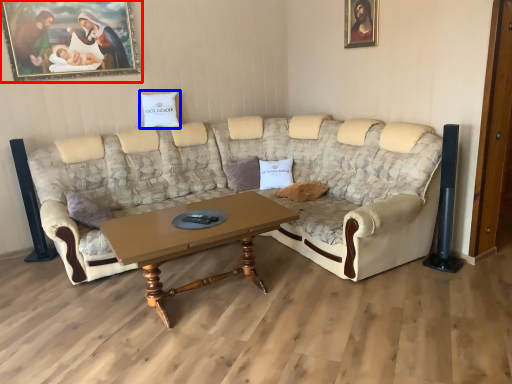
Question: Which object is further to the camera taking this photo, picture frame (highlighted by a red box) or pillow (highlighted by a blue box)?

Choices:
 (A) picture frame
 (B) pillow

Answer: (B)